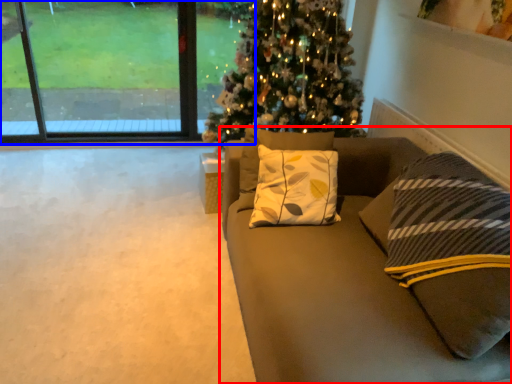
Question: Among these objects, which one is nearest to the camera, studio couch (highlighted by a red box) or window (highlighted by a blue box)?

Choices:
 (A) studio couch
 (B) window

Answer: (A)